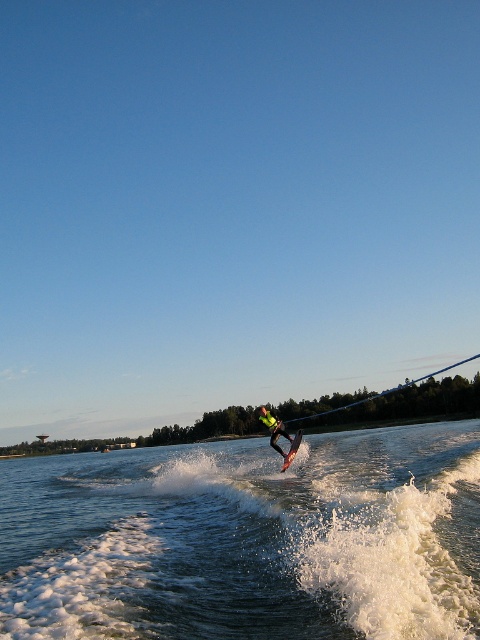
Find the location of a particular element. Image resolution: width=480 pixels, height=640 pixels. translucent water at center is located at coordinates (248, 540).

Which is in front, point (324, 518) or point (295, 435)?

Positioned in front is point (324, 518).

Where is `translucent water at center`? Image resolution: width=480 pixels, height=640 pixels. translucent water at center is located at coordinates (248, 540).

Who is positioned more to the left, yellow-green fabric at center or shiny metallic water ski at center?

shiny metallic water ski at center

Based on the photo, is yellow-green fabric at center thinner than shiny metallic water ski at center?

No, yellow-green fabric at center is not thinner than shiny metallic water ski at center.

The height and width of the screenshot is (640, 480). I want to click on yellow-green fabric at center, so click(273, 428).

The image size is (480, 640). In order to click on yellow-green fabric at center in this screenshot , I will do `click(273, 428)`.

Is translucent water at center thinner than yellow-green fabric at center?

No.

Is translucent water at center taller than yellow-green fabric at center?

In fact, translucent water at center may be shorter than yellow-green fabric at center.

You are a GUI agent. You are given a task and a screenshot of the screen. Output one action in this format:
    pyautogui.click(x=<x>, y=<y>)
    Task: Click on the translucent water at center
    This screenshot has width=480, height=640.
    Given the screenshot: What is the action you would take?
    pyautogui.click(x=248, y=540)